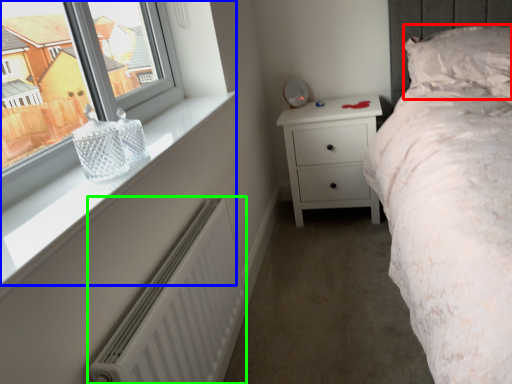
Question: Estimate the real-world distances between objects in this image. Which object is farther from pillow (highlighted by a red box), window (highlighted by a blue box) or radiator (highlighted by a green box)?

Choices:
 (A) window
 (B) radiator

Answer: (B)